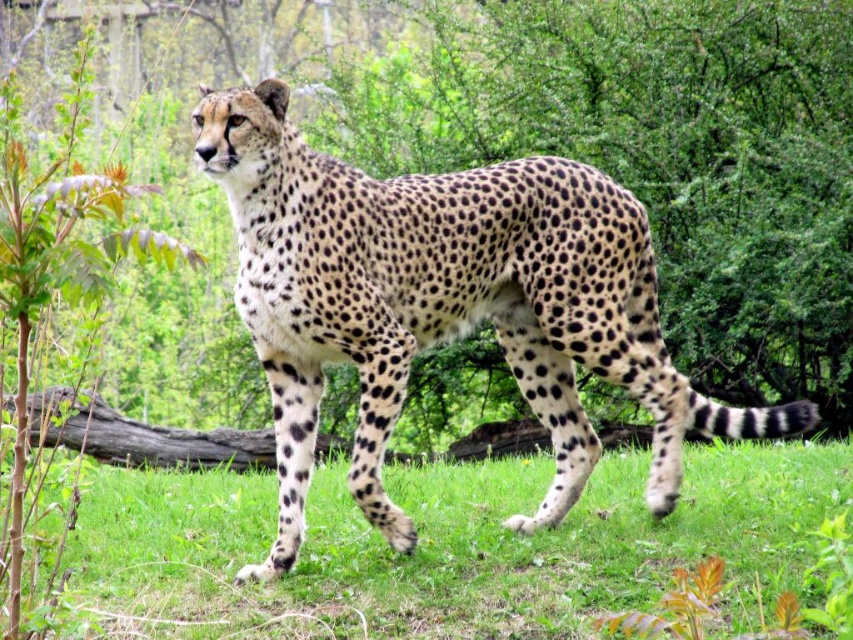
Question: Which object appears closest to the camera in this image?

Choices:
 (A) spotted fur cheetah at center
 (B) green soft grass at lower center

Answer: (B)

Question: Is spotted fur cheetah at center smaller than green soft grass at lower center?

Choices:
 (A) no
 (B) yes

Answer: (B)

Question: Observing the image, what is the correct spatial positioning of spotted fur cheetah at center in reference to green soft grass at lower center?

Choices:
 (A) right
 (B) left

Answer: (B)

Question: In this image, where is spotted fur cheetah at center located relative to green soft grass at lower center?

Choices:
 (A) left
 (B) right

Answer: (A)